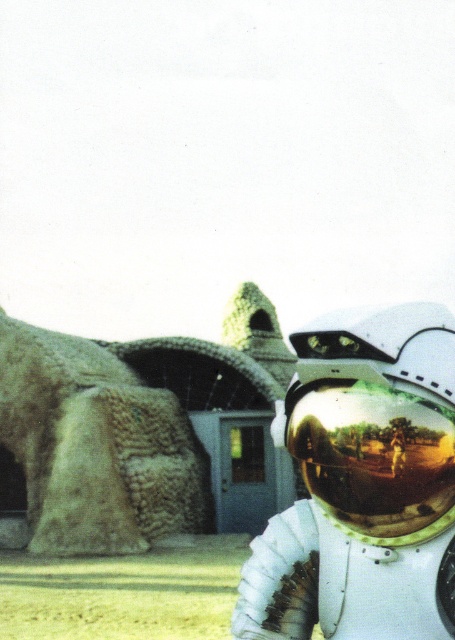
In the surreal desert scene with the astronaut and the cave structure, there is a point marked at coordinates (x=96, y=445). Which object in the scene does this coordinate point to?

The point at coordinates (x=96, y=445) corresponds to the rustic stone sculpture at left.

You are an astronaut in a desert environment. You notice a shiny gold helmet at center and a rustic stone sculpture at left. Which object is taller?

The rustic stone sculpture at left is taller than the shiny gold helmet at center.